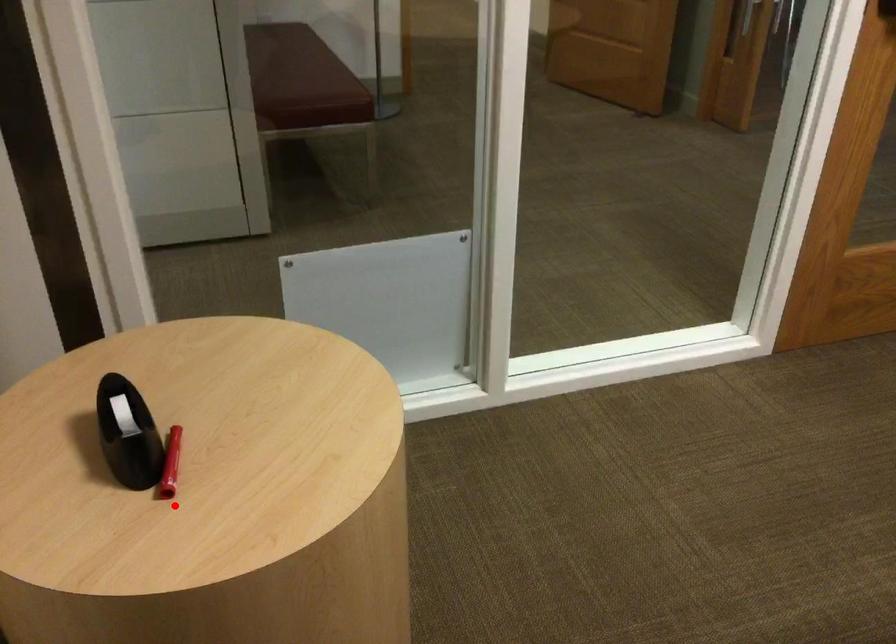
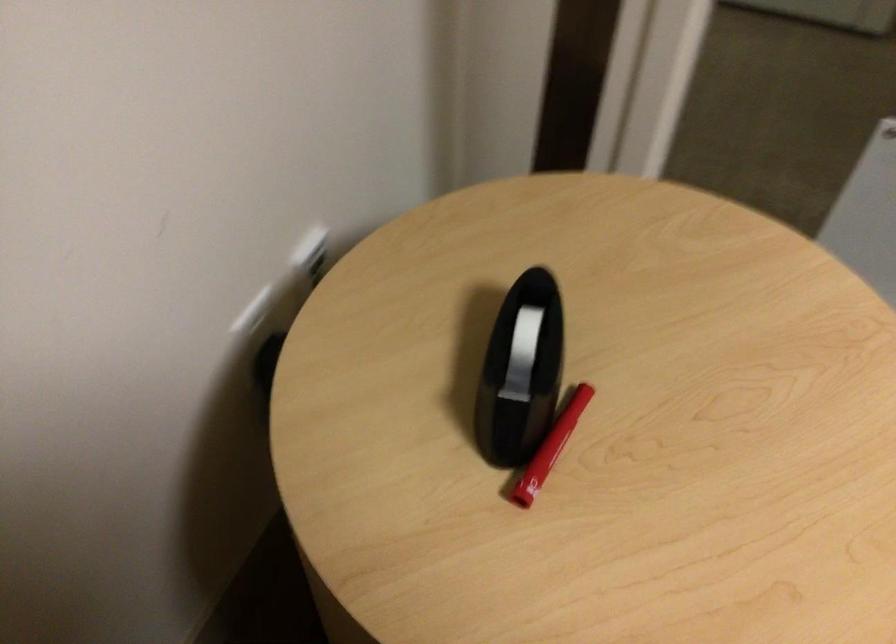
Find the pixel in the second image that matches the highlighted location in the first image.

(527, 511)